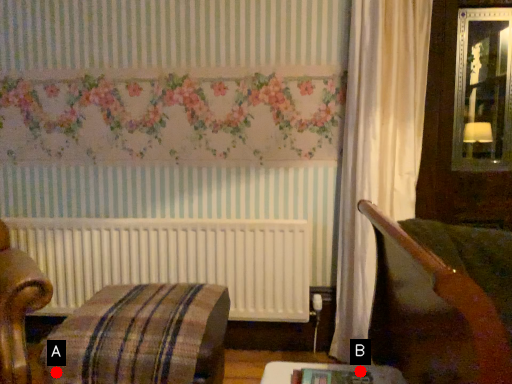
Question: Two points are circled on the image, labeled by A and B beside each circle. Among these points, which one is farthest from the camera?

Choices:
 (A) A is further
 (B) B is further

Answer: (A)